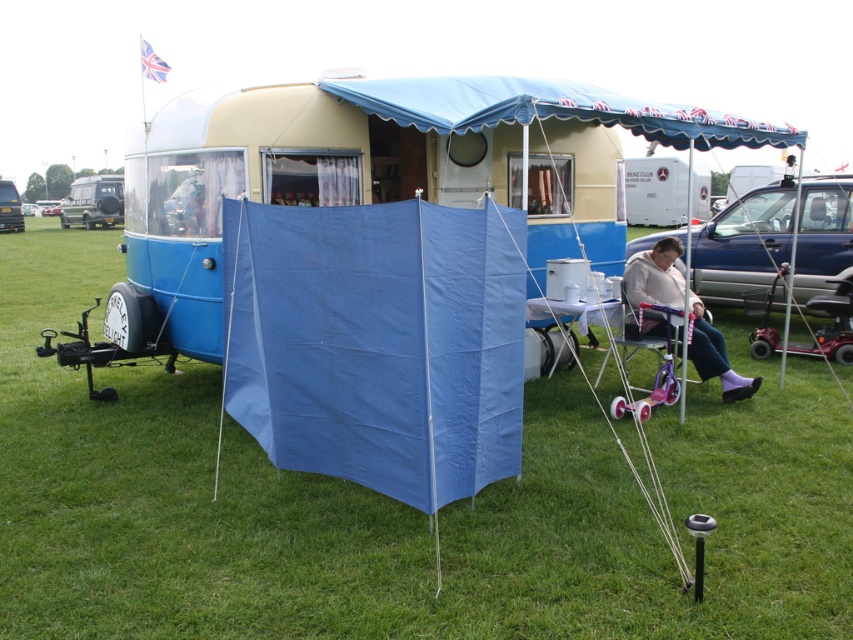
Can you confirm if blue fabric tent at center is thinner than white plastic food truck at upper center?

Correct, blue fabric tent at center's width is less than white plastic food truck at upper center's.

Is blue fabric tent at center positioned at the back of white plastic food truck at upper center?

No, it is in front of white plastic food truck at upper center.

The height and width of the screenshot is (640, 853). What do you see at coordinates (378, 340) in the screenshot?
I see `blue fabric tent at center` at bounding box center [378, 340].

The width and height of the screenshot is (853, 640). I want to click on blue fabric tent at center, so click(x=378, y=340).

Is white plastic food truck at upper center closer to camera compared to metallic blue trailer at left?

Yes, it is.

Does white plastic food truck at upper center appear over metallic blue trailer at left?

Actually, white plastic food truck at upper center is below metallic blue trailer at left.

This screenshot has width=853, height=640. What do you see at coordinates (654, 189) in the screenshot? I see `white plastic food truck at upper center` at bounding box center [654, 189].

Locate an element on the screen. The width and height of the screenshot is (853, 640). white plastic food truck at upper center is located at coordinates (654, 189).

Between blue fabric tent at center and metallic blue trailer at left, which one is positioned lower?

blue fabric tent at center is lower down.

Is blue fabric tent at center positioned before metallic blue trailer at left?

Yes, it is in front of metallic blue trailer at left.

Does point (270, 248) lie in front of point (6, 196)?

Yes, it is in front of point (6, 196).

Where is `blue fabric tent at center`? blue fabric tent at center is located at coordinates (378, 340).